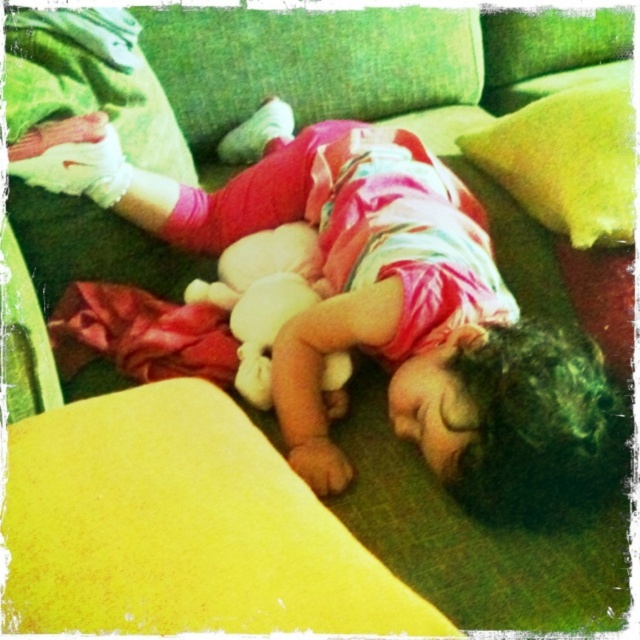
Question: Does green fabric pillow at upper center lie in front of fluffy white teddy bear at center?

Choices:
 (A) yes
 (B) no

Answer: (B)

Question: Which object is farther from the camera taking this photo?

Choices:
 (A) soft pink fabric at center
 (B) green fabric pillow at upper center

Answer: (B)

Question: From the image, what is the correct spatial relationship of soft pink fabric at center in relation to fluffy white teddy bear at center?

Choices:
 (A) right
 (B) left

Answer: (A)

Question: Which point is closer to the camera taking this photo?

Choices:
 (A) (605, 125)
 (B) (433, 416)

Answer: (B)

Question: Among these objects, which one is farthest from the camera?

Choices:
 (A) fluffy white teddy bear at center
 (B) green fabric pillow at upper center

Answer: (B)

Question: Can you confirm if soft pink fabric at center is bigger than fluffy white teddy bear at center?

Choices:
 (A) no
 (B) yes

Answer: (B)